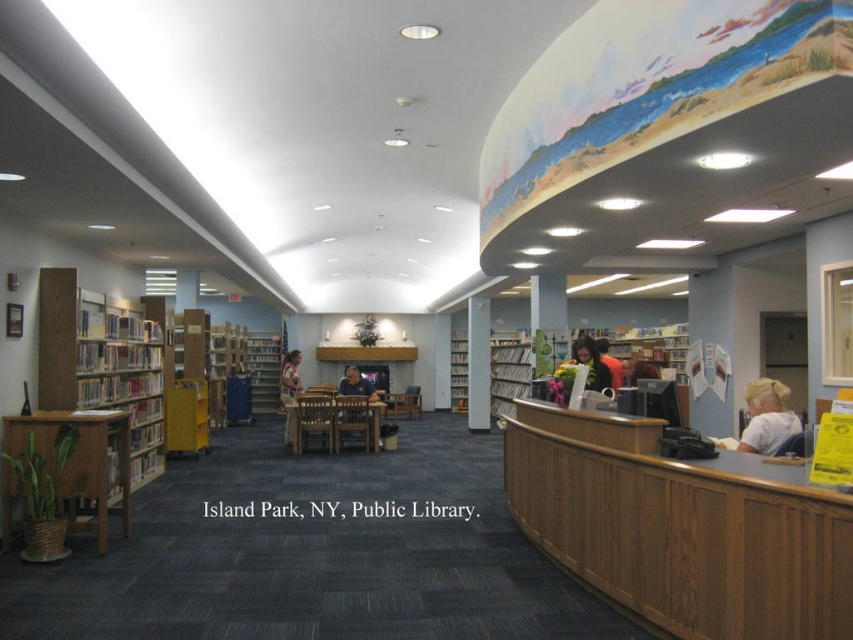
Describe the element at coordinates (102, 362) in the screenshot. I see `wooden bookshelf at left` at that location.

Can you confirm if wooden bookshelf at left is taller than orange fabric bag at center?

Correct, wooden bookshelf at left is much taller as orange fabric bag at center.

Between point (125, 392) and point (599, 372), which one is positioned in front?

Positioned in front is point (599, 372).

You are a GUI agent. You are given a task and a screenshot of the screen. Output one action in this format:
    pyautogui.click(x=<x>, y=<y>)
    Task: Click on the wooden bookshelf at left
    This screenshot has width=853, height=640.
    Given the screenshot: What is the action you would take?
    pyautogui.click(x=102, y=362)

Who is more distant from viewer, (373, 390) or (601, 352)?

Point (373, 390)

Locate an element on the screen. The width and height of the screenshot is (853, 640). wooden chair at center is located at coordinates (357, 385).

Image resolution: width=853 pixels, height=640 pixels. In order to click on white glossy pillar at center in this screenshot , I will do [479, 364].

Is point (473, 353) in front of point (260, 392)?

Yes, it is.

You are a GUI agent. You are given a task and a screenshot of the screen. Output one action in this format:
    pyautogui.click(x=<x>, y=<y>)
    Task: Click on the white glossy pillar at center
    This screenshot has width=853, height=640.
    Given the screenshot: What is the action you would take?
    pyautogui.click(x=479, y=364)

The image size is (853, 640). I want to click on white glossy pillar at center, so click(479, 364).